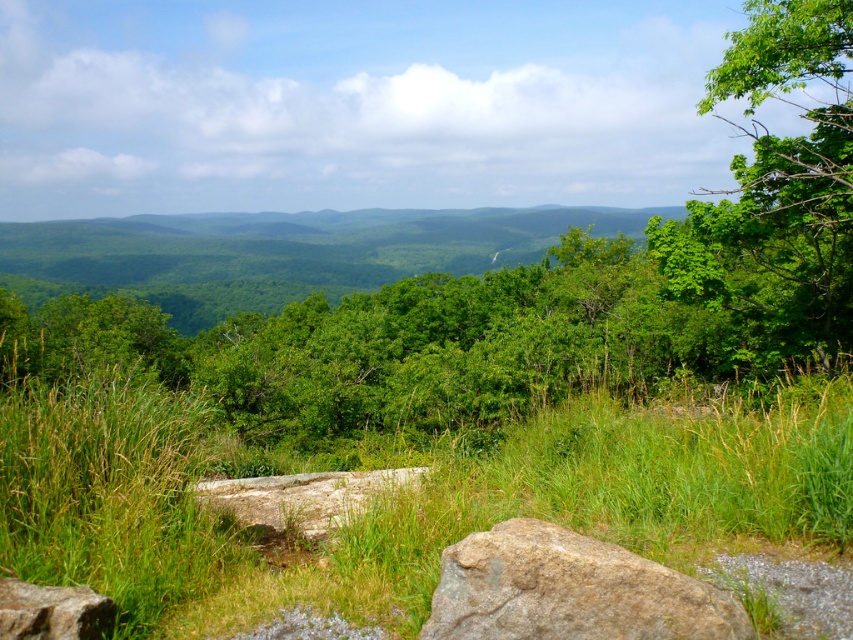
Question: Which point appears farthest from the camera in this image?

Choices:
 (A) (772, 163)
 (B) (16, 589)

Answer: (A)

Question: Which point is closer to the camera taking this photo?

Choices:
 (A) (x=672, y=506)
 (B) (x=192, y=488)

Answer: (A)

Question: Can you confirm if green leafy tree at upper right is smaller than gray rock at center?

Choices:
 (A) no
 (B) yes

Answer: (A)

Question: Based on their relative distances, which object is nearer to the brown rough boulder at lower left?

Choices:
 (A) green grassy at center
 (B) brown rough rock at lower center
 (C) gray rock at center

Answer: (A)

Question: Is brown rough rock at lower center further to the viewer compared to gray rock at center?

Choices:
 (A) no
 (B) yes

Answer: (A)

Question: Is gray rock at center wider than brown rough boulder at lower left?

Choices:
 (A) yes
 (B) no

Answer: (A)